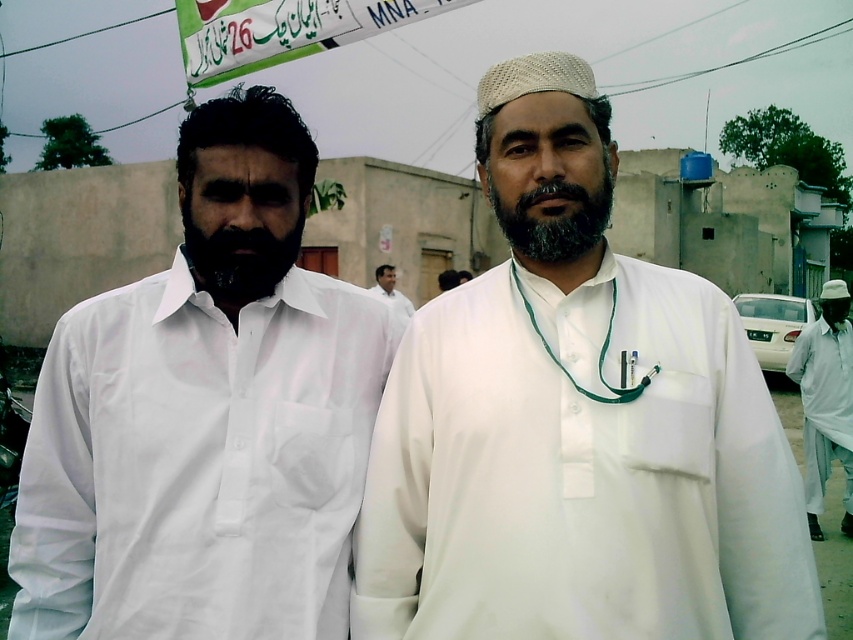
You are a photographer trying to capture the black matte beard at center in your shot. Based on the scene description, where should you position your camera to ensure the beard is centered in the frame?

The black matte beard at center is already positioned at the center of the image at coordinates point (238, 259), so positioning the camera to center the frame on that point will ensure the beard is centered.